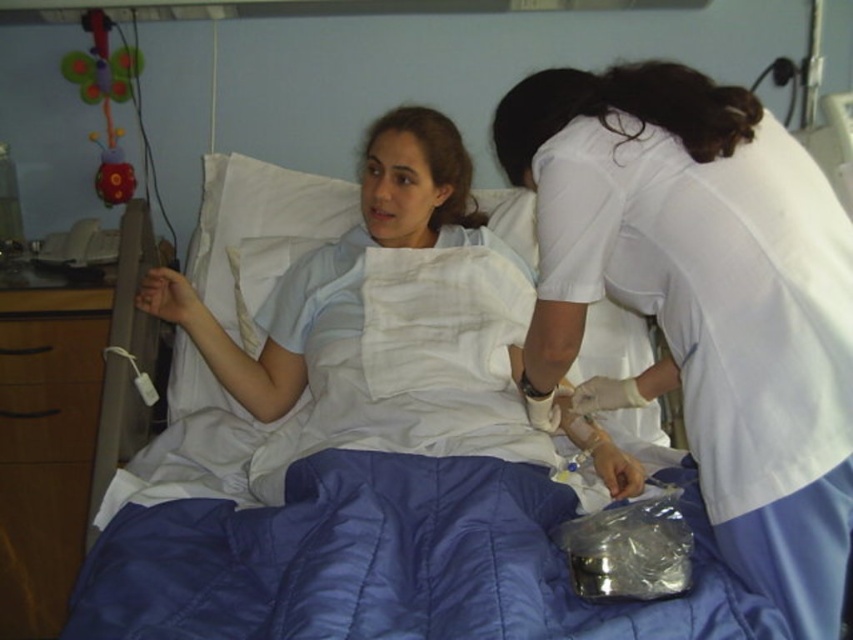
You are a nurse who needs to move a medical chart from the wooden drawer at left to the blue quilted bed at center. Considering their sizes, which object will require more space to place the chart?

The blue quilted bed at center has a larger size compared to wooden drawer at left, so placing the medical chart on the blue quilted bed at center will require more space.